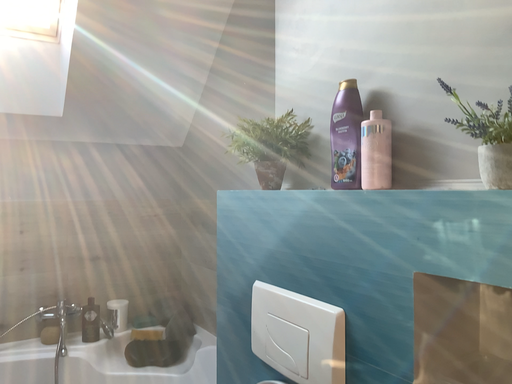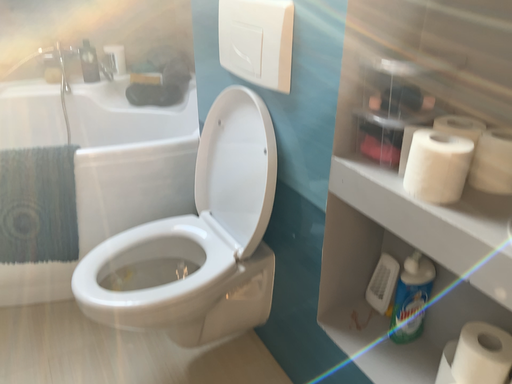
Question: How did the camera likely rotate when shooting the video?

Choices:
 (A) rotated downward
 (B) rotated upward

Answer: (A)